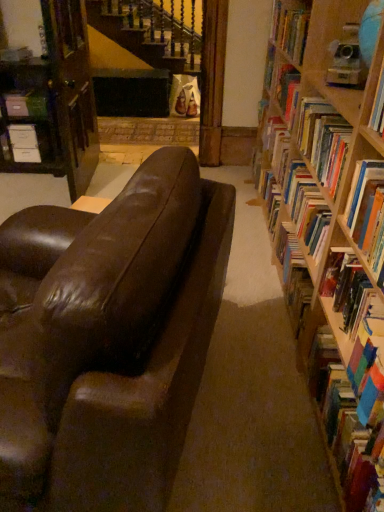
Question: Can you confirm if wooden bookcase at left is positioned to the left of shiny brown leather couch at center?

Choices:
 (A) no
 (B) yes

Answer: (B)

Question: Does wooden bookcase at left have a greater width compared to shiny brown leather couch at center?

Choices:
 (A) yes
 (B) no

Answer: (B)

Question: Is wooden bookcase at left completely or partially outside of shiny brown leather couch at center?

Choices:
 (A) yes
 (B) no

Answer: (A)

Question: Is wooden bookcase at left aimed at shiny brown leather couch at center?

Choices:
 (A) yes
 (B) no

Answer: (B)

Question: Can you confirm if wooden bookcase at left is bigger than shiny brown leather couch at center?

Choices:
 (A) no
 (B) yes

Answer: (A)

Question: In terms of size, does multicolored paperbacks at right, the second book in the front-to-back sequence, appear bigger or smaller than shiny brown leather couch at center?

Choices:
 (A) small
 (B) big

Answer: (A)

Question: Considering the positions of multicolored paperbacks at right, positioned as the 4th book in top-to-bottom order, and shiny brown leather couch at center in the image, is multicolored paperbacks at right, positioned as the 4th book in top-to-bottom order, wider or thinner than shiny brown leather couch at center?

Choices:
 (A) thin
 (B) wide

Answer: (A)

Question: Is multicolored paperbacks at right, the first book positioned from the bottom, situated inside shiny brown leather couch at center or outside?

Choices:
 (A) inside
 (B) outside

Answer: (B)

Question: Is point (360, 442) closer or farther from the camera than point (183, 318)?

Choices:
 (A) closer
 (B) farther

Answer: (B)

Question: From the image's perspective, is shiny brown leather couch at center above or below hardcover book at right, marked as the second book in a top-to-bottom arrangement?

Choices:
 (A) above
 (B) below

Answer: (B)

Question: In the image, is shiny brown leather couch at center positioned in front of or behind hardcover book at right, which is the 3th book from bottom to top?

Choices:
 (A) behind
 (B) front

Answer: (B)

Question: In the image, is shiny brown leather couch at center on the left side or the right side of hardcover book at right, which is the 3th book from bottom to top?

Choices:
 (A) left
 (B) right

Answer: (A)

Question: Is shiny brown leather couch at center taller or shorter than hardcover book at right, the 3th book positioned from the front?

Choices:
 (A) short
 (B) tall

Answer: (B)

Question: Is hardcover book at upper right, which is the first book from top to bottom, inside or outside of matte white paperback book at center?

Choices:
 (A) outside
 (B) inside

Answer: (A)

Question: In terms of size, does hardcover book at upper right, which is the first book from top to bottom, appear bigger or smaller than matte white paperback book at center?

Choices:
 (A) small
 (B) big

Answer: (B)